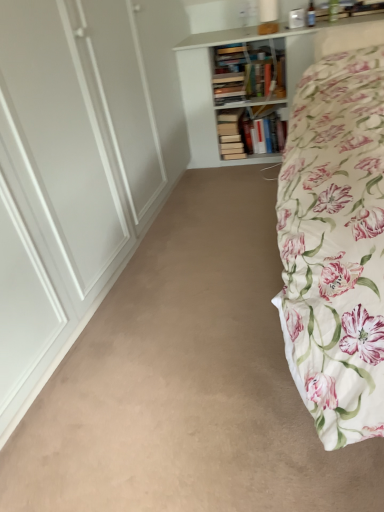
Question: Considering the relative positions of floral cotton bed at right and white wooden bookcase at upper center in the image provided, is floral cotton bed at right to the left or to the right of white wooden bookcase at upper center?

Choices:
 (A) left
 (B) right

Answer: (B)

Question: Looking at the image, does floral cotton bed at right seem bigger or smaller compared to white wooden bookcase at upper center?

Choices:
 (A) big
 (B) small

Answer: (A)

Question: Estimate the real-world distances between objects in this image. Which object is farther from the beige carpet at center?

Choices:
 (A) floral cotton bed at right
 (B) white wooden bookcase at upper center

Answer: (B)

Question: Which is farther from the white wooden bookcase at upper center?

Choices:
 (A) beige carpet at center
 (B) floral cotton bed at right

Answer: (A)